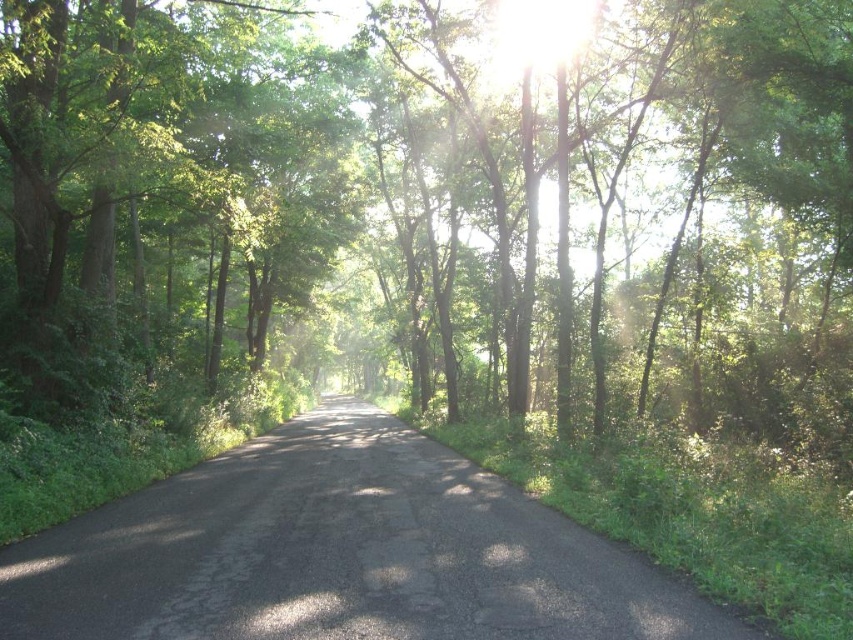
Who is shorter, black asphalt road at center or green leafy tree at left?

black asphalt road at center

Can you confirm if black asphalt road at center is positioned to the left of green leafy tree at left?

In fact, black asphalt road at center is to the right of green leafy tree at left.

What do you see at coordinates (340, 552) in the screenshot?
I see `black asphalt road at center` at bounding box center [340, 552].

At what (x,y) coordinates should I click in order to perform the action: click on black asphalt road at center. Please return your answer as a coordinate pair (x, y). Looking at the image, I should click on (340, 552).

What do you see at coordinates (440, 204) in the screenshot? I see `green leafy tree at center` at bounding box center [440, 204].

Is green leafy tree at center shorter than black asphalt road at center?

No.

Who is more forward, (613,163) or (242,465)?

Point (242,465) is in front.

You are a GUI agent. You are given a task and a screenshot of the screen. Output one action in this format:
    pyautogui.click(x=<x>, y=<y>)
    Task: Click on the green leafy tree at center
    The width and height of the screenshot is (853, 640).
    Given the screenshot: What is the action you would take?
    pyautogui.click(x=440, y=204)

Which is more to the right, green leafy tree at center or green leafy tree at left?

Positioned to the right is green leafy tree at center.

Does point (827, 216) come in front of point (91, 161)?

No, (827, 216) is further to viewer.

Who is more distant from viewer, (619, 385) or (264, 35)?

Positioned behind is point (264, 35).

The height and width of the screenshot is (640, 853). What are the coordinates of `green leafy tree at center` in the screenshot? It's located at (440, 204).